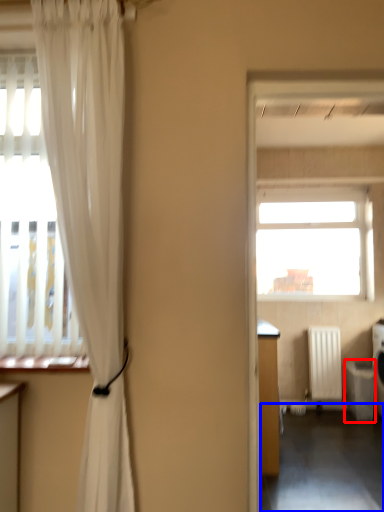
Question: Which object is further to the camera taking this photo, dish washer (highlighted by a red box) or corridor (highlighted by a blue box)?

Choices:
 (A) dish washer
 (B) corridor

Answer: (A)